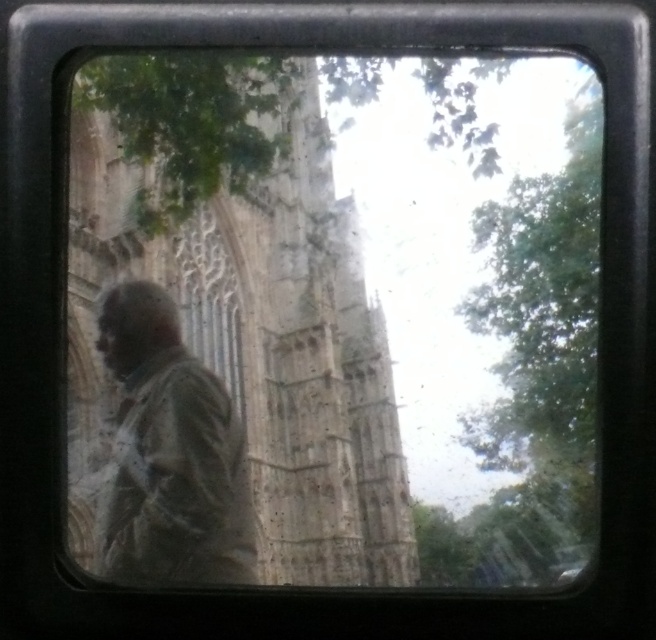
Question: Which point is farther to the camera?

Choices:
 (A) tap(279, 273)
 (B) tap(180, 348)

Answer: (A)

Question: Does transparent glass window at center come behind distressed brown jacket at left?

Choices:
 (A) yes
 (B) no

Answer: (B)

Question: Which point is closer to the camera taking this photo?

Choices:
 (A) (565, 323)
 (B) (125, 444)

Answer: (B)

Question: Does transparent glass window at center appear on the right side of distressed brown jacket at left?

Choices:
 (A) no
 (B) yes

Answer: (B)

Question: In this image, where is transparent glass window at center located relative to distressed brown jacket at left?

Choices:
 (A) left
 (B) right

Answer: (B)